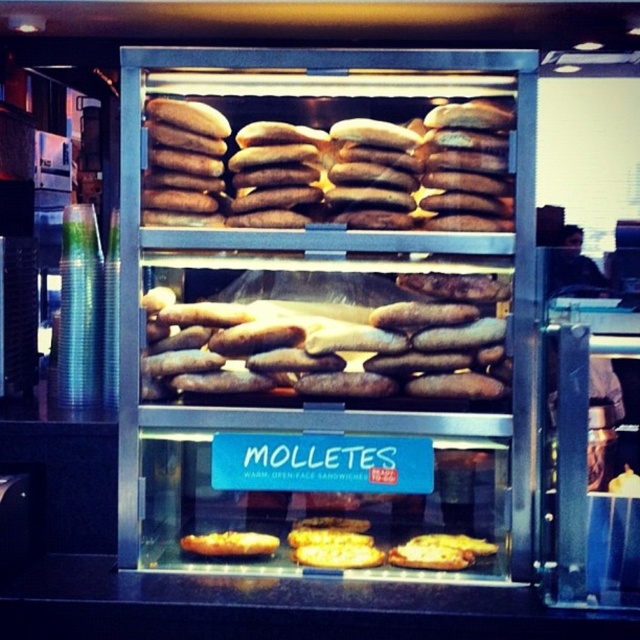
You are a customer in the bakery and want to choose between the brown matte baguette at center and the golden brown bread at lower center. Which one is taller?

The brown matte baguette at center is much taller than the golden brown bread at lower center.

You are a customer looking at the bakery display case. You see two points marked in the image. The first point is at coordinate (324, 204) and the second is at (333, 369). From your perspective, which point is closer to you?

Point (333, 369) is closer to you because it is in front of point (324, 204).